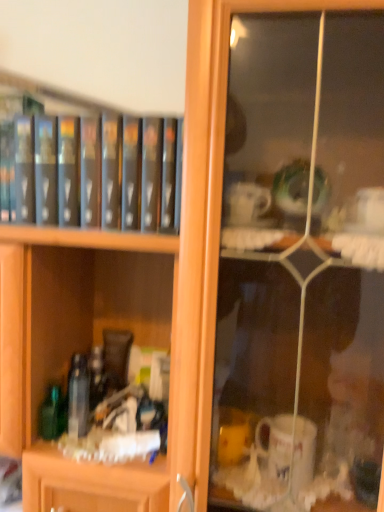
Question: Would you say clear glass bottle at center, arranged as the second bottle when viewed from the left, is part of green glass bottle at lower left, which is the 1th bottle in left-to-right order,'s contents?

Choices:
 (A) yes
 (B) no

Answer: (B)

Question: Considering the relative sizes of green glass bottle at lower left, which is the 1th bottle in left-to-right order, and clear glass bottle at center, the first bottle from the right, in the image provided, is green glass bottle at lower left, which is the 1th bottle in left-to-right order, wider than clear glass bottle at center, the first bottle from the right,?

Choices:
 (A) yes
 (B) no

Answer: (A)

Question: Can you confirm if green glass bottle at lower left, which appears as the second bottle when viewed from the right, is shorter than clear glass bottle at center, the first bottle from the right?

Choices:
 (A) no
 (B) yes

Answer: (B)

Question: Is green glass bottle at lower left, which is the 1th bottle in left-to-right order, in front of clear glass bottle at center, the first bottle from the right?

Choices:
 (A) no
 (B) yes

Answer: (A)

Question: From the image's perspective, is green glass bottle at lower left, which appears as the second bottle when viewed from the right, below clear glass bottle at center, arranged as the second bottle when viewed from the left?

Choices:
 (A) no
 (B) yes

Answer: (B)

Question: Considering the positions of point [x=124, y=117] and point [x=74, y=410], is point [x=124, y=117] closer or farther from the camera than point [x=74, y=410]?

Choices:
 (A) farther
 (B) closer

Answer: (B)

Question: Based on their sizes in the image, would you say black matte book at upper left is bigger or smaller than clear glass bottle at center, arranged as the second bottle when viewed from the left?

Choices:
 (A) big
 (B) small

Answer: (A)

Question: Considering their positions, is black matte book at upper left located in front of or behind clear glass bottle at center, arranged as the second bottle when viewed from the left?

Choices:
 (A) behind
 (B) front

Answer: (B)

Question: From the image's perspective, relative to clear glass bottle at center, arranged as the second bottle when viewed from the left, is black matte book at upper left above or below?

Choices:
 (A) above
 (B) below

Answer: (A)

Question: Looking at the image, does black matte book at upper left seem bigger or smaller compared to green glass bottle at lower left, which appears as the second bottle when viewed from the right?

Choices:
 (A) big
 (B) small

Answer: (A)

Question: Choose the correct answer: Is black matte book at upper left inside green glass bottle at lower left, which is the 1th bottle in left-to-right order, or outside it?

Choices:
 (A) inside
 (B) outside

Answer: (B)

Question: Considering the positions of black matte book at upper left and green glass bottle at lower left, which appears as the second bottle when viewed from the right, in the image, is black matte book at upper left taller or shorter than green glass bottle at lower left, which appears as the second bottle when viewed from the right,?

Choices:
 (A) short
 (B) tall

Answer: (B)

Question: From a real-world perspective, relative to green glass bottle at lower left, which appears as the second bottle when viewed from the right, is black matte book at upper left vertically above or below?

Choices:
 (A) above
 (B) below

Answer: (A)

Question: Looking at the image, does green glass bottle at lower left, which is the 1th bottle in left-to-right order, seem bigger or smaller compared to clear glass bottle at center, the first bottle from the right?

Choices:
 (A) small
 (B) big

Answer: (A)

Question: From the image's perspective, is green glass bottle at lower left, which is the 1th bottle in left-to-right order, positioned above or below clear glass bottle at center, the first bottle from the right?

Choices:
 (A) below
 (B) above

Answer: (A)